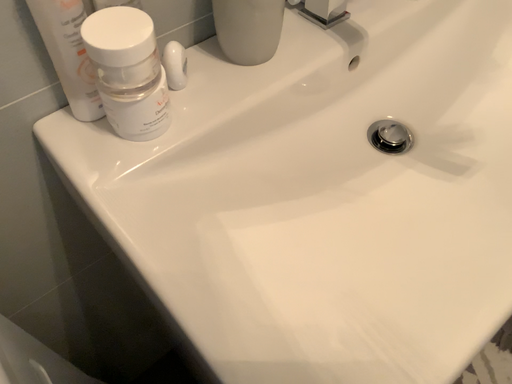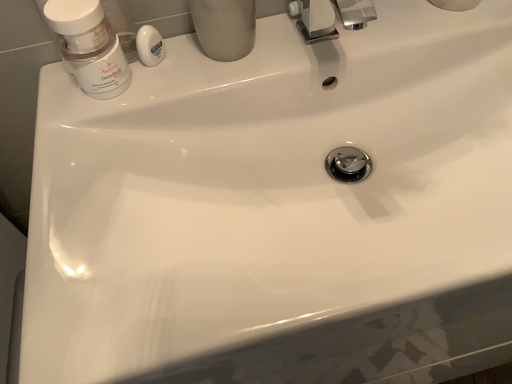
Question: Which way did the camera rotate in the video?

Choices:
 (A) rotated left
 (B) rotated right

Answer: (A)